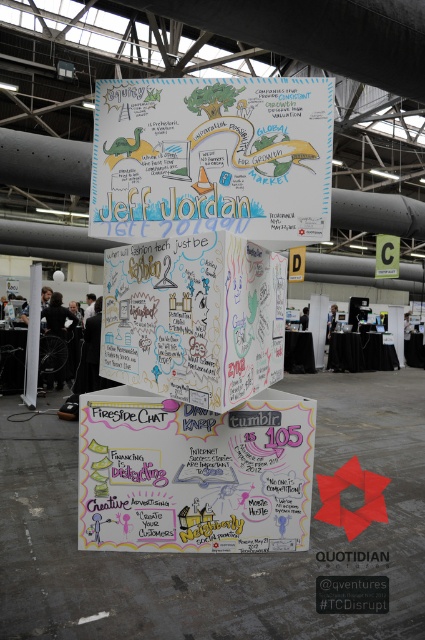
You are a photographer standing in the middle of the room, and you want to take a photo of the white chalkboard at center. You have a camera that requires you to be exactly 3.5 feet away from the subject to focus properly. Can you position yourself correctly to take the photo without moving the camera or chalkboard?

The white chalkboard at center and camera are 3.58 feet apart. Since the required distance is 3.5 feet, the photographer can move slightly closer to achieve the correct distance of 3.5 feet.

You are setting up a display for an event and need to place the white paperboard at center and the white cardboard box at center on a table. The table has a width of 1.2 meters. Can both items fit side by side on the table without overlapping?

The white paperboard at center is wider than the white cardboard box at center. However, since the exact widths are not provided, it is impossible to determine if both can fit side by side on the 1.2 meter table without overlapping.